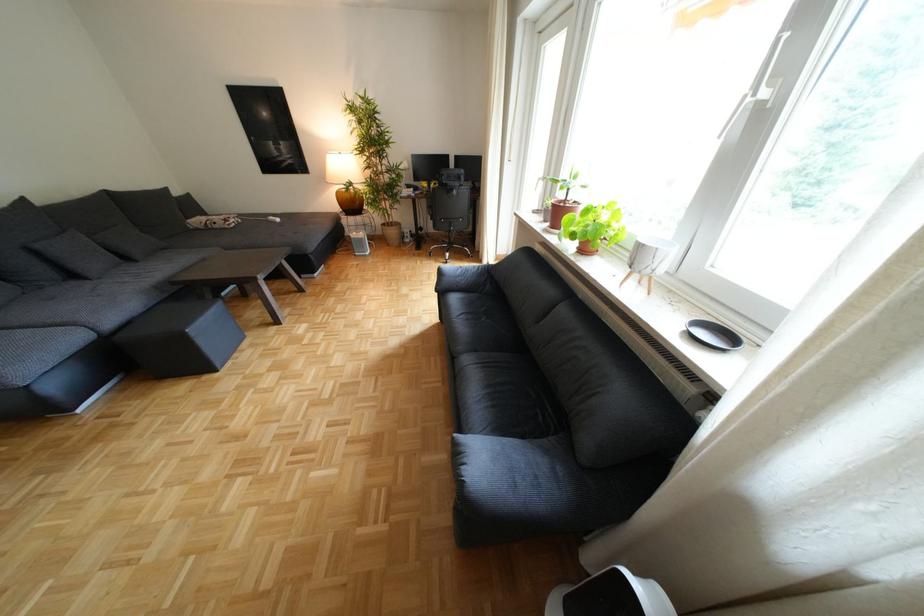
You are a GUI agent. You are given a task and a screenshot of the screen. Output one action in this format:
    pyautogui.click(x=<x>, y=<y>)
    Task: Click on the wicker plant pot
    This screenshot has width=924, height=616.
    Given the screenshot: What is the action you would take?
    (x=392, y=233)